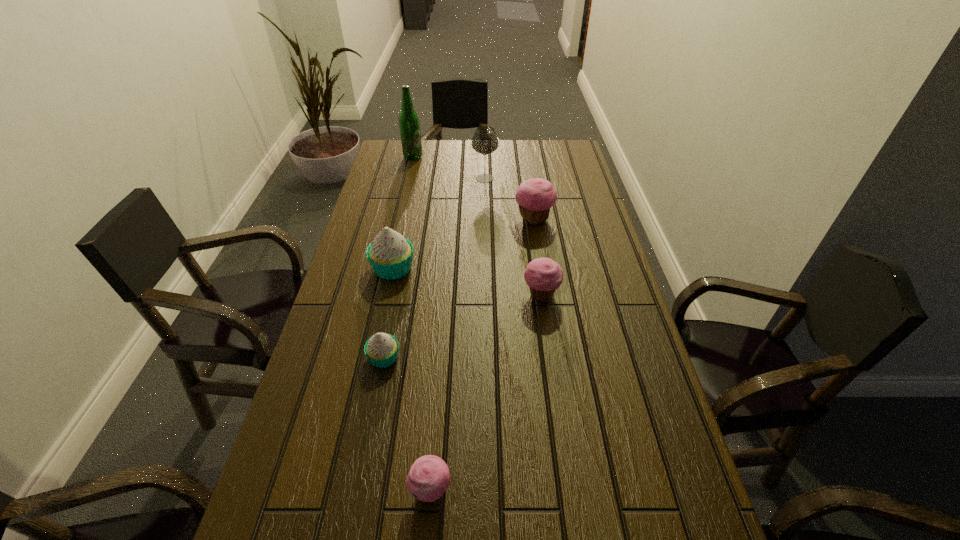
Identify the location of the smaller white cupcake. (381, 349).

Where is `the smallest pink cupcake`? This screenshot has width=960, height=540. the smallest pink cupcake is located at coordinates (429, 477).

You are a GUI agent. You are given a task and a screenshot of the screen. Output one action in this format:
    pyautogui.click(x=<x>, y=<y>)
    Task: Click on the leftmost pink cupcake
    Image resolution: width=960 pixels, height=540 pixels.
    Given the screenshot: What is the action you would take?
    pyautogui.click(x=429, y=477)

I want to click on vacant space situated 0.220m on the label of the farthest object, so click(x=476, y=157).

You are a GUI agent. You are given a task and a screenshot of the screen. Output one action in this format:
    pyautogui.click(x=<x>, y=<y>)
    Task: Click on the free space located 0.150m on the back of the gray wineglass
    Image resolution: width=960 pixels, height=540 pixels.
    Given the screenshot: What is the action you would take?
    pyautogui.click(x=485, y=154)

Where is `blank area located on the front of the third farthest object`? Image resolution: width=960 pixels, height=540 pixels. blank area located on the front of the third farthest object is located at coordinates (540, 253).

Where is `vacant area situated on the right of the bigger white cupcake`? vacant area situated on the right of the bigger white cupcake is located at coordinates (436, 268).

Identify the location of blank area located 0.270m on the left of the third shortest object. click(426, 295).

Locate an element on the screen. The width and height of the screenshot is (960, 540). vacant space located on the right of the smaller white cupcake is located at coordinates (523, 357).

What are the coordinates of `free spot located 0.320m on the back of the nearest object` in the screenshot? It's located at pyautogui.click(x=443, y=343).